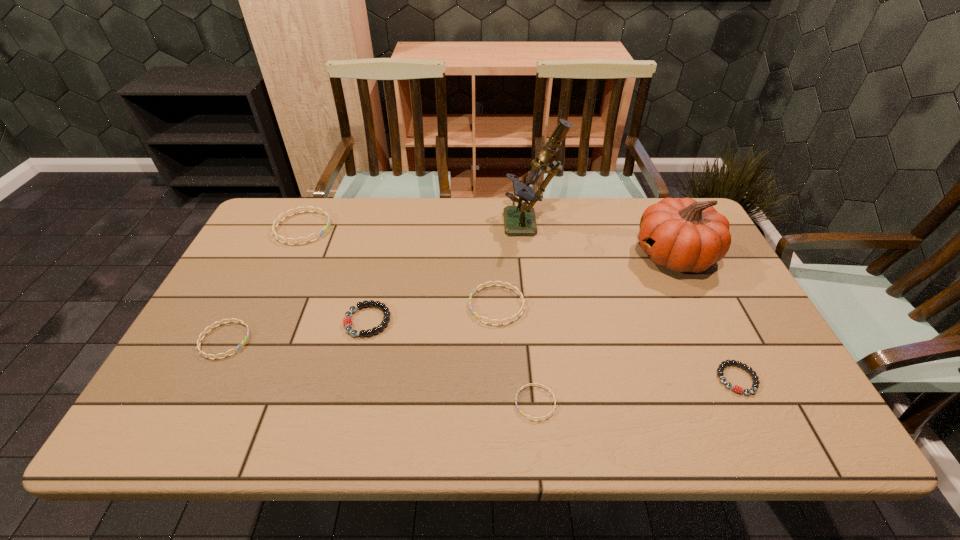
Where is `the right black bracelet`? The width and height of the screenshot is (960, 540). the right black bracelet is located at coordinates (720, 369).

Locate an element on the screen. This screenshot has height=540, width=960. the rightmost bracelet is located at coordinates click(720, 369).

This screenshot has height=540, width=960. I want to click on the shortest bracelet, so click(539, 419).

I want to click on the smallest blue bracelet, so click(539, 419).

Image resolution: width=960 pixels, height=540 pixels. Find the location of `vacant point located 0.350m at the eyepiece of the tallest object`. vacant point located 0.350m at the eyepiece of the tallest object is located at coordinates (396, 226).

Locate an element on the screen. The image size is (960, 540). vacant area situated 0.100m at the eyepiece of the tallest object is located at coordinates (473, 226).

You are a GUI agent. You are given a task and a screenshot of the screen. Output one action in this format:
    pyautogui.click(x=<x>, y=<y>)
    Task: Click on the vacant region located at the eyepiece of the tallest object
    Image resolution: width=960 pixels, height=540 pixels.
    Given the screenshot: What is the action you would take?
    pyautogui.click(x=420, y=226)

You are a GUI agent. You are given a task and a screenshot of the screen. Output one action in this format:
    pyautogui.click(x=<x>, y=<y>)
    Task: Click on the vacant space located on the face of the seventh shortest object
    
    Given the screenshot: What is the action you would take?
    pyautogui.click(x=516, y=255)

At what (x,y) coordinates should I click in order to perform the action: click on vacant space situated on the face of the seventh shortest object. Please return your answer as a coordinate pair (x, y). The width and height of the screenshot is (960, 540). Looking at the image, I should click on (589, 255).

Image resolution: width=960 pixels, height=540 pixels. What are the coordinates of `free spot located on the face of the seventh shortest object` in the screenshot? It's located at (542, 255).